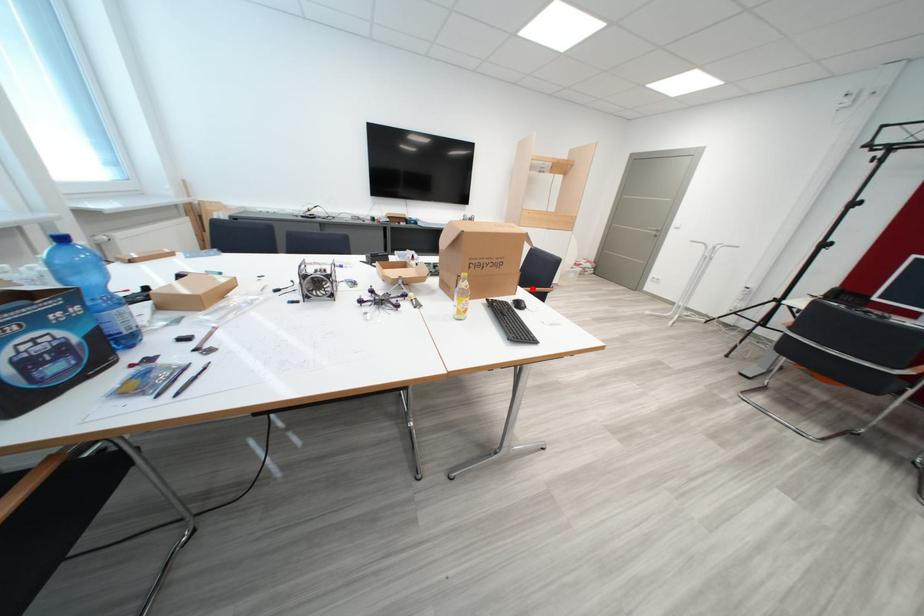
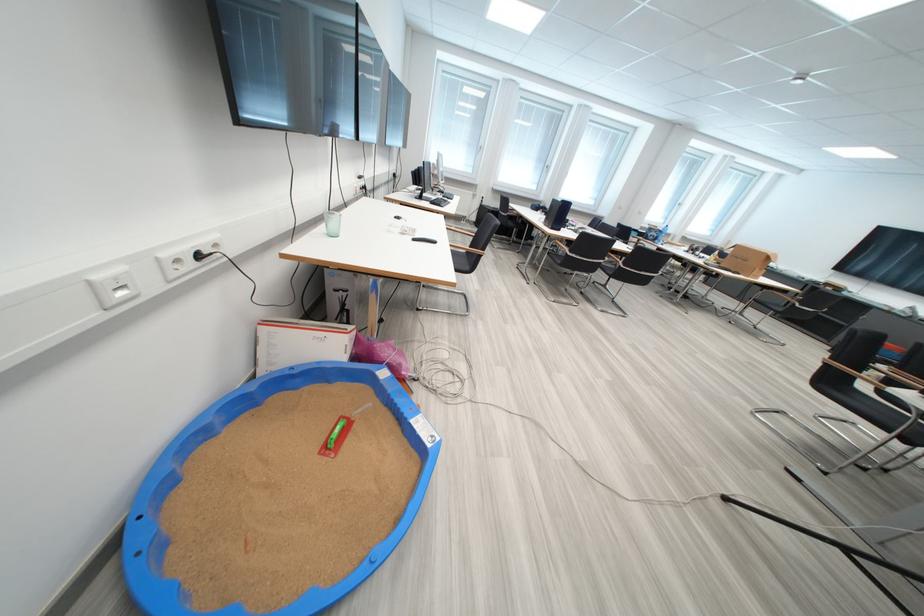
Question: I am providing you with two images of the same scene from different viewpoints. A red point is marked on the first image. Can you still see the location of the red point in image 2?

Choices:
 (A) Yes
 (B) No

Answer: (B)